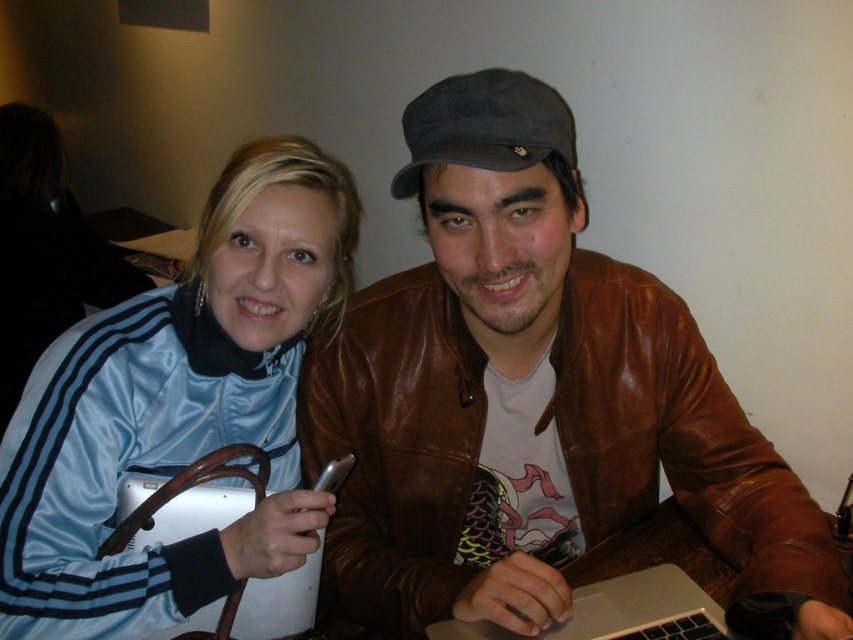
You are a photographer taking a picture of the scene. You notice the satin blue jacket at upper left and the silver metallic laptop at center. Which object is closer to you in the photo?

The satin blue jacket at upper left is closer to you because it is further to the viewer than the silver metallic laptop at center.

Consider the image. You are a photographer trying to capture a candid shot of the two people in the scene. You notice the satin blue jacket at upper left and the silver metallic laptop at center. Which object is taller in the image?

The satin blue jacket at upper left has a greater height compared to the silver metallic laptop at center, so the satin blue jacket at upper left is taller.

You are a tailor measuring jackets for alterations. You have two jackets in front of you, the brown leather jacket at center and the satin blue jacket at upper left. Which one requires a wider sleeve alteration to fit a larger arm?

The brown leather jacket at center requires a wider sleeve alteration because it is wider than the satin blue jacket at upper left.